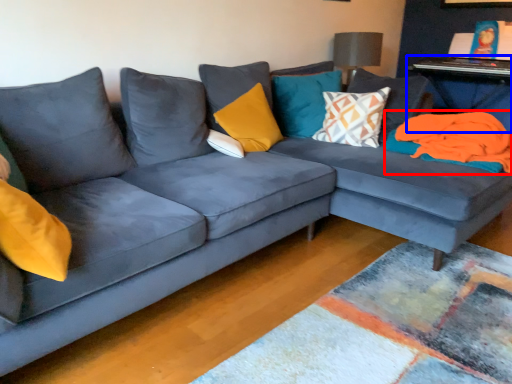
Question: Among these objects, which one is farthest to the camera, material (highlighted by a red box) or table (highlighted by a blue box)?

Choices:
 (A) material
 (B) table

Answer: (B)